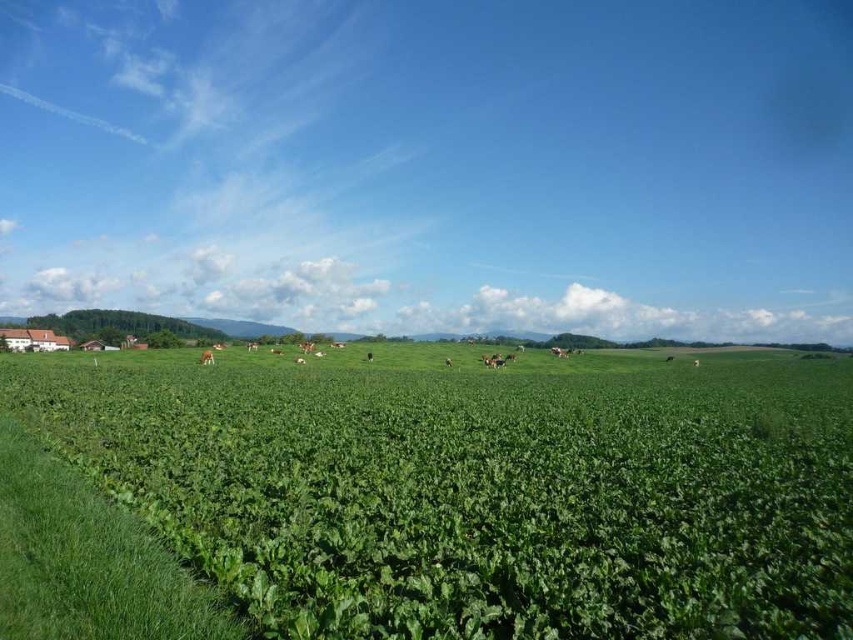
Question: Does green leafy field at center have a larger size compared to brown furry cow at center?

Choices:
 (A) no
 (B) yes

Answer: (B)

Question: Which of the following is the closest to the observer?

Choices:
 (A) (207, 353)
 (B) (834, 506)

Answer: (B)

Question: Which point is farther from the camera taking this photo?

Choices:
 (A) (604, 381)
 (B) (200, 356)

Answer: (B)

Question: Does green leafy field at center have a smaller size compared to brown furry cow at center?

Choices:
 (A) no
 (B) yes

Answer: (A)

Question: Among these points, which one is nearest to the camera?

Choices:
 (A) (263, 401)
 (B) (201, 353)

Answer: (A)

Question: Is green leafy field at center closer to camera compared to brown furry cow at center?

Choices:
 (A) no
 (B) yes

Answer: (B)